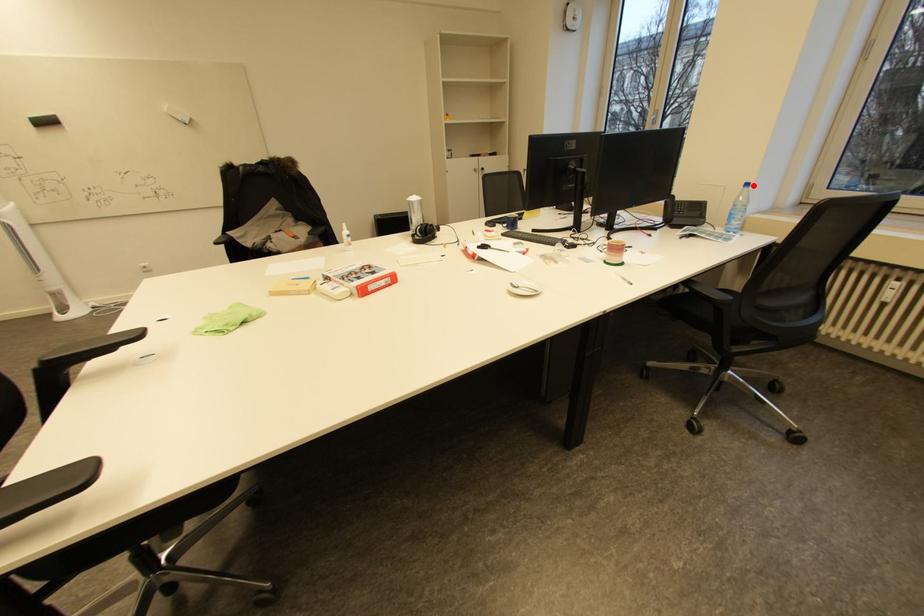
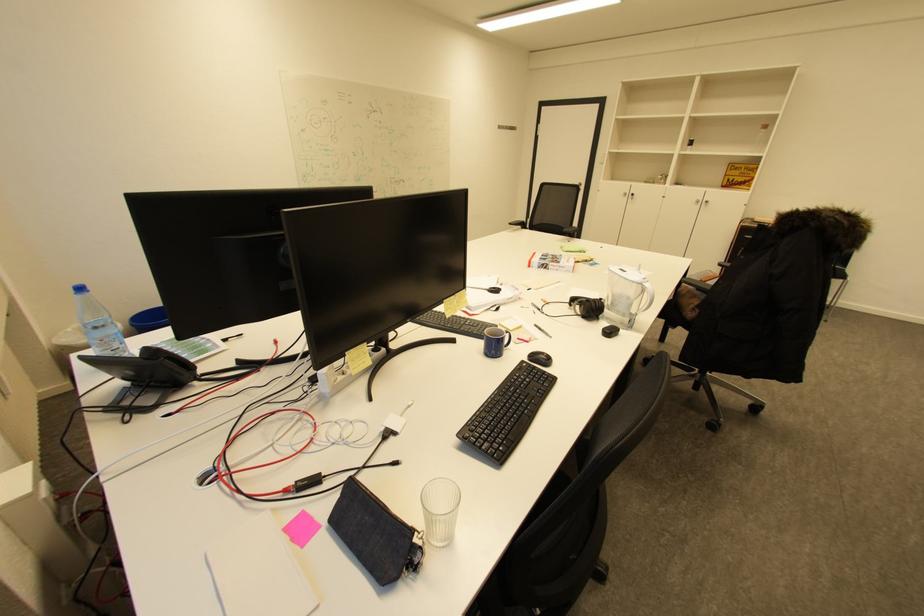
Locate, in the second image, the point that corresponds to the highlighted location in the first image.

(88, 290)